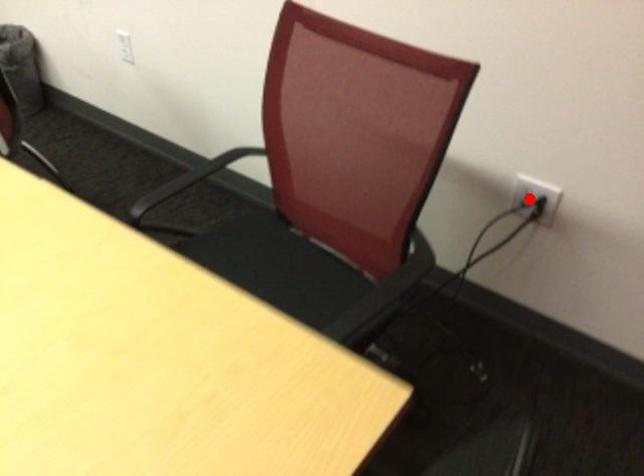
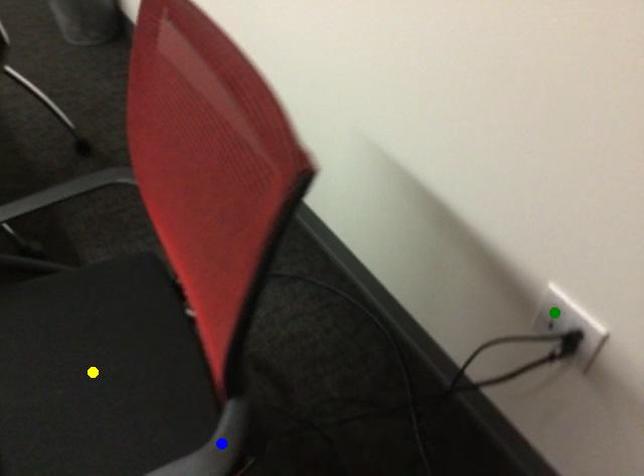
Question: I am providing you with two images of the same scene from different viewpoints. A red point is marked on the first image. You are given multiple points on the second image. In image 2, which mark is for the same physical point as the one in image 1?

Choices:
 (A) green point
 (B) blue point
 (C) yellow point

Answer: (A)